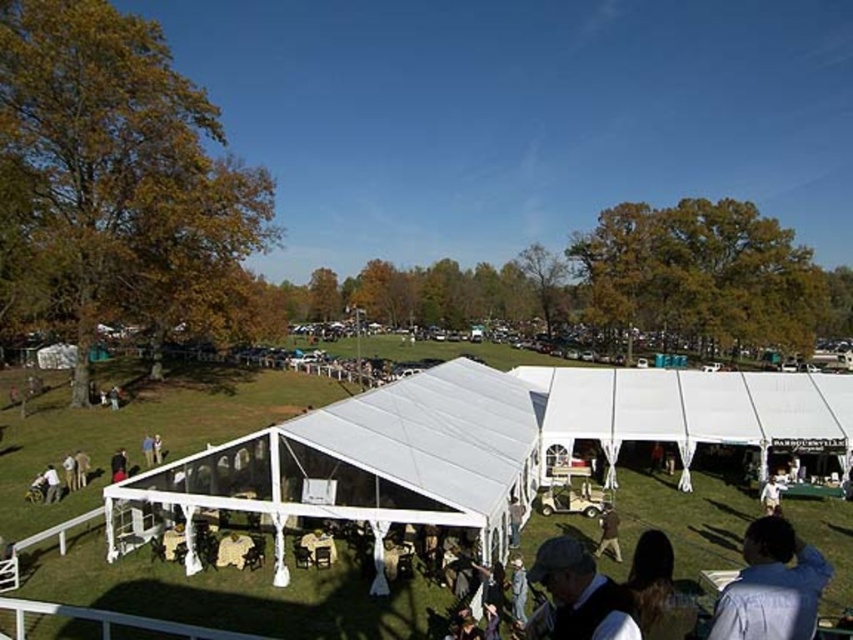
Who is shorter, blue shirt at lower right or brown leather jacket at lower center?

With less height is blue shirt at lower right.

Is blue shirt at lower right further to camera compared to brown leather jacket at lower center?

No, it is not.

This screenshot has width=853, height=640. What are the coordinates of `blue shirt at lower right` in the screenshot? It's located at (770, 586).

Is matte gray hat at lower center further to camera compared to brown leather jacket at lower center?

No, it is in front of brown leather jacket at lower center.

Who is more distant from viewer, (590, 582) or (604, 522)?

The point (604, 522) is more distant.

Where is `matte gray hat at lower center`? matte gray hat at lower center is located at coordinates (581, 593).

Who is positioned more to the left, brown leather jacket at lower center or light brown leather jacket at center?

Positioned to the left is light brown leather jacket at center.

The image size is (853, 640). Identify the location of brown leather jacket at lower center. (608, 532).

Locate an element on the screen. Image resolution: width=853 pixels, height=640 pixels. brown leather jacket at lower center is located at coordinates tap(608, 532).